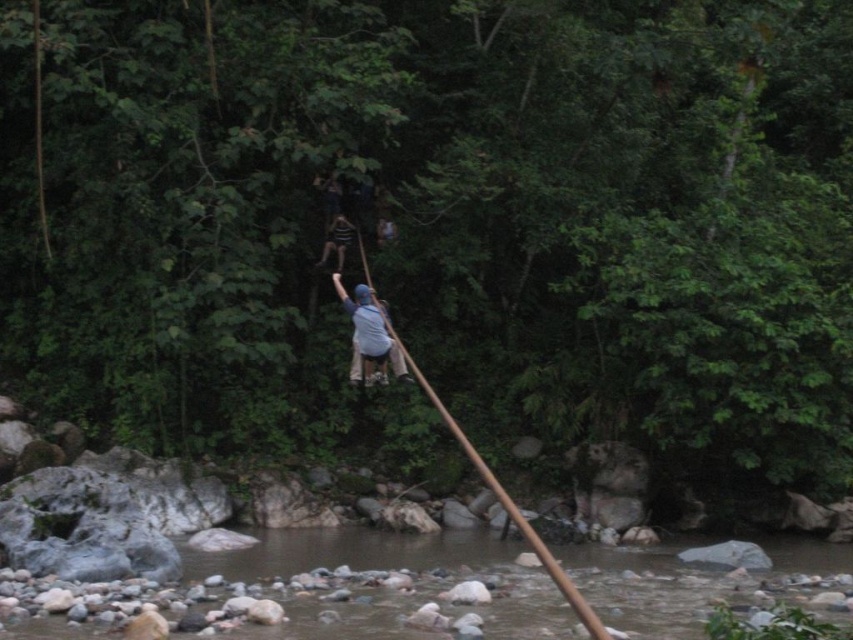
Question: In this image, where is brown rocky water at lower center located relative to light blue fabric at center?

Choices:
 (A) above
 (B) below

Answer: (B)

Question: Which of these objects is positioned closest to the brown rocky water at lower center?

Choices:
 (A) light blue fabric at center
 (B) striped fabric shirt at center

Answer: (A)

Question: Which of these objects is positioned closest to the striped fabric shirt at center?

Choices:
 (A) light blue fabric at center
 (B) brown rocky water at lower center

Answer: (A)

Question: Is brown rocky water at lower center thinner than light blue fabric at center?

Choices:
 (A) yes
 (B) no

Answer: (B)

Question: Which point is farther to the camera?

Choices:
 (A) striped fabric shirt at center
 (B) light blue fabric at center

Answer: (A)

Question: Can you confirm if light blue fabric at center is bigger than striped fabric shirt at center?

Choices:
 (A) yes
 (B) no

Answer: (A)